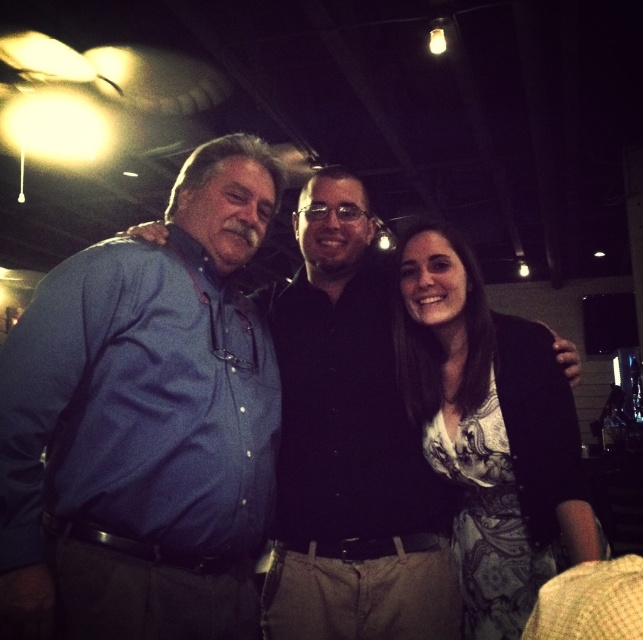
Question: Which point is farther to the camera?

Choices:
 (A) patterned fabric dress at center
 (B) matte blue shirt at center
 (C) blue cotton shirt at left

Answer: (A)

Question: Which point is closer to the camera?

Choices:
 (A) (188, 595)
 (B) (109, 275)

Answer: (B)

Question: Based on their relative distances, which object is nearer to the patterned fabric dress at center?

Choices:
 (A) blue cotton shirt at left
 (B) matte blue shirt at center

Answer: (B)

Question: Can you confirm if blue cotton shirt at left is positioned above patterned fabric dress at center?

Choices:
 (A) yes
 (B) no

Answer: (A)

Question: Can you confirm if matte blue shirt at center is positioned to the left of patterned fabric dress at center?

Choices:
 (A) yes
 (B) no

Answer: (A)

Question: Is blue cotton shirt at left bigger than patterned fabric dress at center?

Choices:
 (A) no
 (B) yes

Answer: (B)